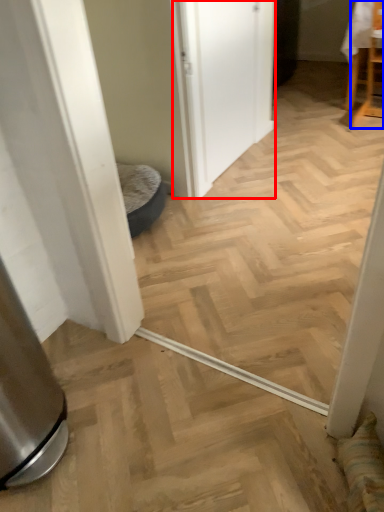
Question: Which object is further to the camera taking this photo, screen door (highlighted by a red box) or chair (highlighted by a blue box)?

Choices:
 (A) screen door
 (B) chair

Answer: (B)